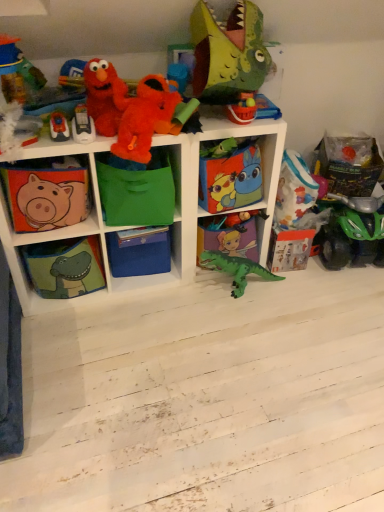
At what (x,y) coordinates should I click in order to perform the action: click on free space in front of blue cardboard box at center, the first box viewed from the left. Please return your answer as a coordinate pair (x, y). The width and height of the screenshot is (384, 512). Looking at the image, I should click on (127, 291).